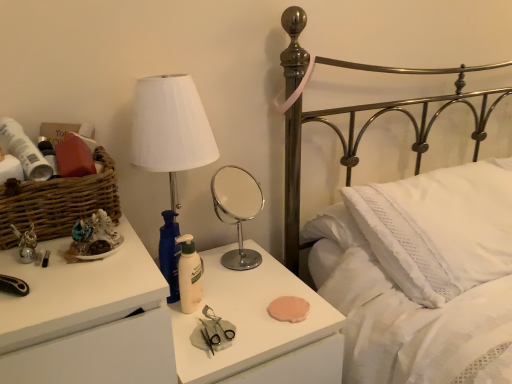
At what (x,y) coordinates should I click in order to perform the action: click on vacant area on the back side of white matte lotion at center. Please return your answer as a coordinate pair (x, y). The image size is (512, 384). Looking at the image, I should click on (221, 278).